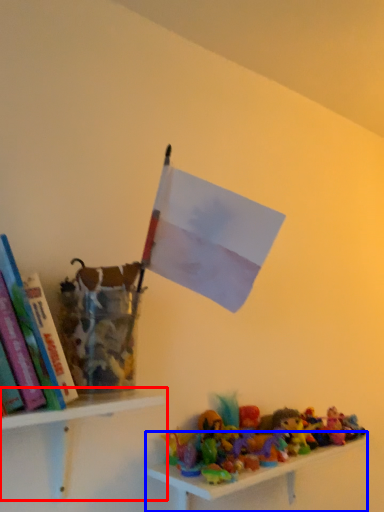
Question: Which object is further to the camera taking this photo, shelf (highlighted by a red box) or shelf (highlighted by a blue box)?

Choices:
 (A) shelf
 (B) shelf

Answer: (B)